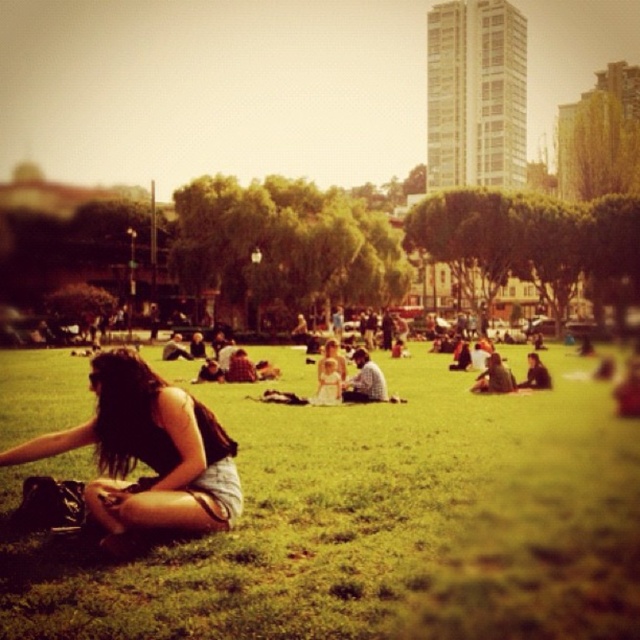
Question: Observing the image, what is the correct spatial positioning of green grassy field at lower left in reference to light blue denim jeans at center?

Choices:
 (A) right
 (B) left

Answer: (B)

Question: Is green grassy field at lower left further to camera compared to light blue denim jeans at center?

Choices:
 (A) yes
 (B) no

Answer: (B)

Question: Can you confirm if matte black tank top at lower left is positioned to the left of light blue denim jeans at center?

Choices:
 (A) no
 (B) yes

Answer: (B)

Question: Among these objects, which one is nearest to the camera?

Choices:
 (A) light blue denim jeans at center
 (B) matte black tank top at lower left

Answer: (B)

Question: Which point is closer to the camera taking this photo?

Choices:
 (A) (108, 380)
 (B) (269, 604)
 (C) (358, 360)

Answer: (B)

Question: Which point is closer to the camera?

Choices:
 (A) (54, 628)
 (B) (145, 445)
 (C) (349, 392)

Answer: (A)